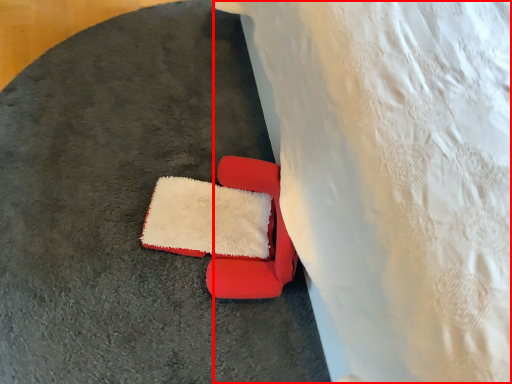
Question: From the image's perspective, where is sheet (annotated by the red box) located relative to chair?

Choices:
 (A) below
 (B) above

Answer: (B)